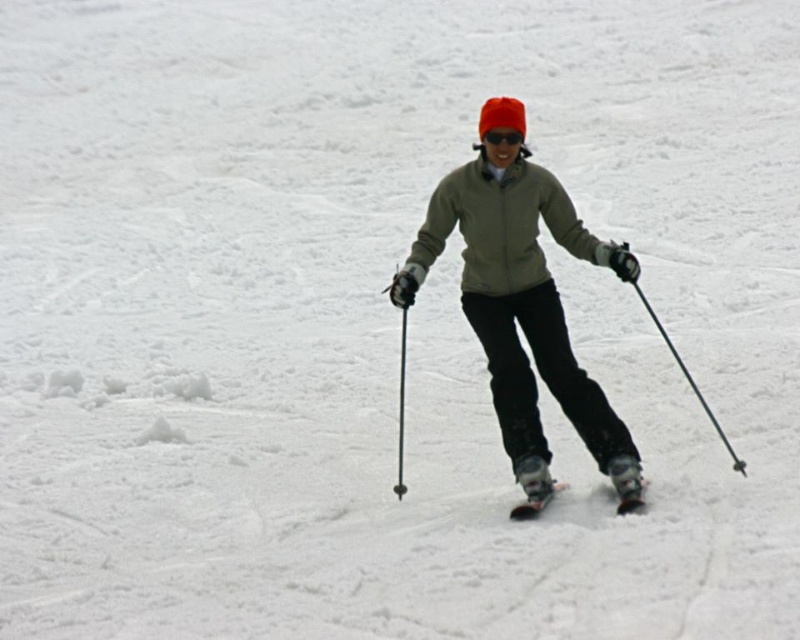
You are a photographer trying to capture a closeup shot of the skier. You need to focus on both the shiny metallic skis at center and the transparent plastic goggles at center. Can you fit both into your camera frame if your camera has a maximum focus range of 3 meters?

The shiny metallic skis at center and transparent plastic goggles at center are 3.02 meters apart from each other, so the distance between them is slightly over the camera frame limit of 3 meters. Therefore, you cannot fit both into the camera frame.

Based on the photo, you are a photographer trying to capture the skier from behind. You notice the shiny metallic skis at center and the transparent plastic goggles at center. Which object should appear closer to the camera in the photo?

The shiny metallic skis at center should appear closer to the camera because they are positioned in front of the transparent plastic goggles at center.

You are a photographer trying to capture a photo of the matte green jacket at center and the black plastic ski pole at right. If you want to frame both objects in your shot, which object should you position closer to the left side of the frame?

The matte green jacket at center is to the left of the black plastic ski pole at right, so you should position the matte green jacket at center closer to the left side of the frame.